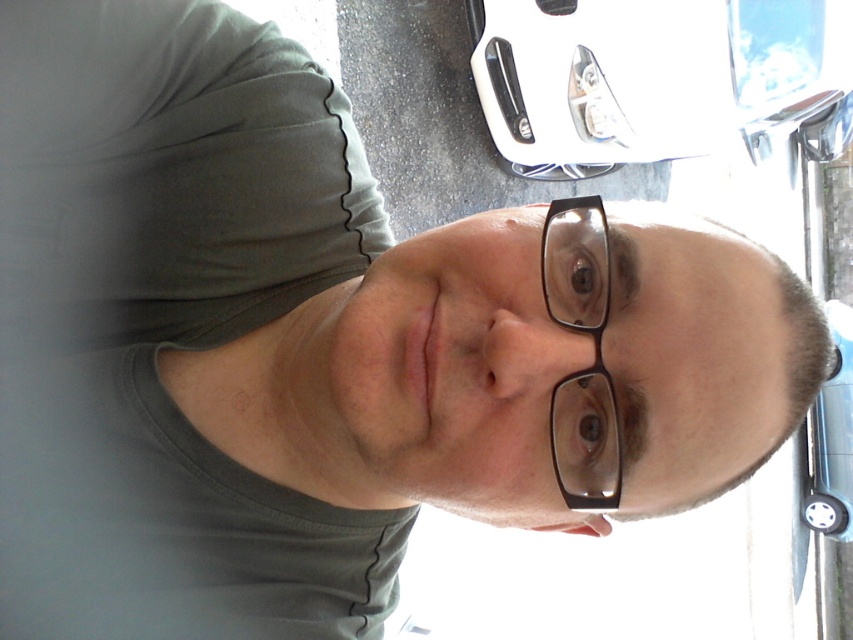
You are a photographer standing at the location where the selfie was taken. You want to place a tripod exactly 3 meters away from the white glossy bumper at upper center. Is the distance sufficient to include both the bumper and the car handle visible in the background in your shot?

The distance between the viewer and the white glossy bumper at upper center is 3.26 meters. Since you want to place the tripod 3 meters away from the bumper, the total distance from your current position would be 3.26 meters minus 3 meters, which is 0.26 meters. This close proximity might make it challenging to fit both the bumper and the car handle in the frame unless using a wide angle lens.

You are taking a selfie and notice two reflective surfaces in the frame. The white glossy bumper at upper center and the transparent plastic glasses at center. Which one is larger in the photo?

The white glossy bumper at upper center is bigger than transparent plastic glasses at center, so it is larger in the photo.

You are taking a selfie and want to ensure both the white glossy bumper at upper center and the transparent plastic glasses at center are visible in the frame. Based on their sizes, which object will occupy more space in the photo?

The white glossy bumper at upper center will occupy more space in the photo because its width is larger than that of the transparent plastic glasses at center.